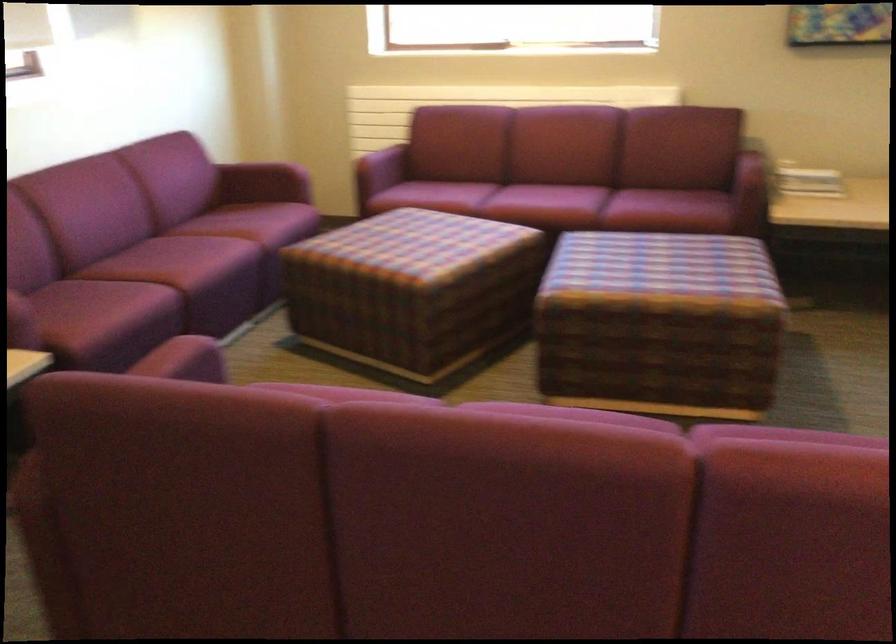
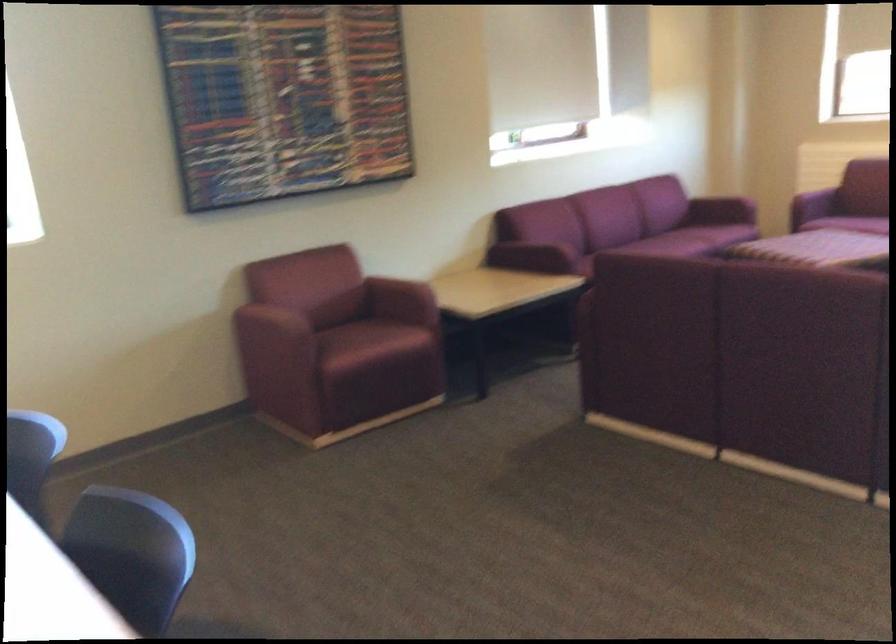
Question: I am providing you with two images of the same scene from different viewpoints. Which of the following objects are not visible in image2?

Choices:
 (A) range hood slider
 (B) maroon sofa sitting surface
 (C) maroon sofa armrest
 (D) purple sofa sitting surface

Answer: (D)